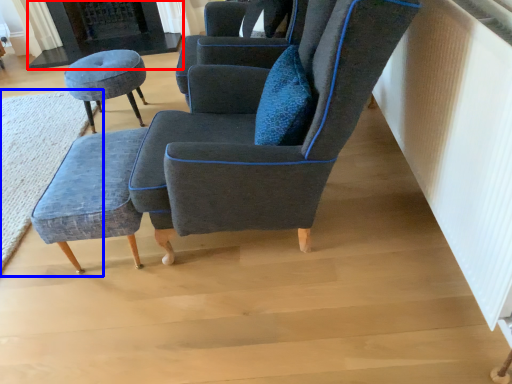
Question: Among these objects, which one is farthest to the camera, fireplace (highlighted by a red box) or mat (highlighted by a blue box)?

Choices:
 (A) fireplace
 (B) mat

Answer: (A)